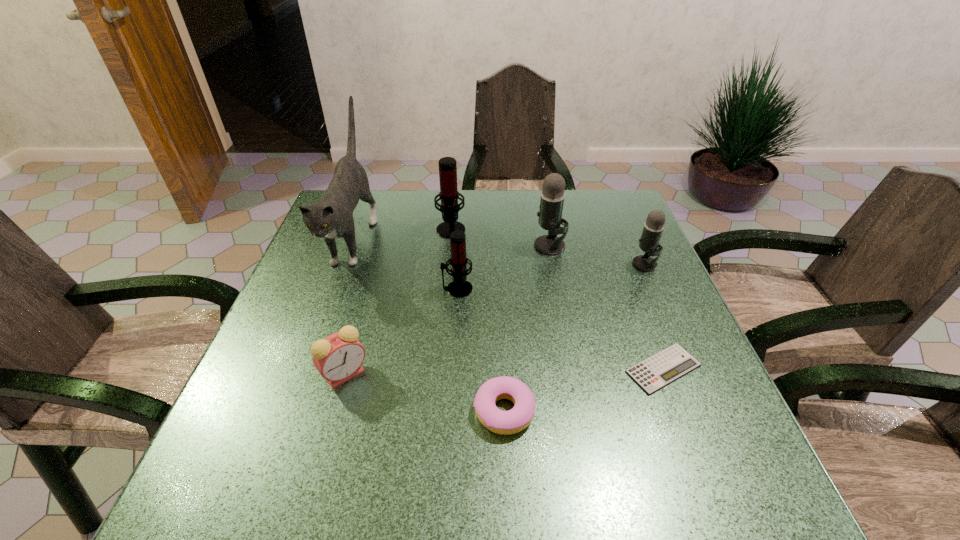
At what (x,y) coordinates should I click in order to perform the action: click on free space between the farther red microphone and the tallest object. Please return your answer as a coordinate pair (x, y). Image resolution: width=960 pixels, height=540 pixels. Looking at the image, I should click on (402, 233).

This screenshot has height=540, width=960. Find the location of `free spot between the fourth object from right to left and the cat`. free spot between the fourth object from right to left and the cat is located at coordinates (428, 324).

In order to click on vacant space that's between the nearer red microphone and the alarm clock in this screenshot , I will do `click(401, 332)`.

Locate which object ranks fifth in proximity to the bigger red microphone. Please provide its 2D coordinates. Your answer should be formatted as a tuple, i.e. [(x, y)], where the tuple contains the x and y coordinates of a point satisfying the conditions above.

[(652, 231)]

Locate which object is the closest to the bigger gray microphone. Please provide its 2D coordinates. Your answer should be formatted as a tuple, i.e. [(x, y)], where the tuple contains the x and y coordinates of a point satisfying the conditions above.

[(652, 231)]

Where is `the fourth closest microphone relative to the alarm clock`? Image resolution: width=960 pixels, height=540 pixels. the fourth closest microphone relative to the alarm clock is located at coordinates (652, 231).

Select which microphone is the second closest to the calculator. Please provide its 2D coordinates. Your answer should be formatted as a tuple, i.e. [(x, y)], where the tuple contains the x and y coordinates of a point satisfying the conditions above.

[(552, 196)]

The width and height of the screenshot is (960, 540). In order to click on vacant space that satisfies the following two spatial constraints: 1. at the face of the fifth object from left to right; 2. on the left side of the tallest object in this screenshot , I will do `click(290, 410)`.

Find the location of a particular element. vacant space that satisfies the following two spatial constraints: 1. at the face of the doughnut; 2. on the right side of the tallest object is located at coordinates (290, 410).

This screenshot has width=960, height=540. Find the location of `vacant space that satisfies the following two spatial constraints: 1. on the front side of the nearest microphone; 2. on the left side of the calculator`. vacant space that satisfies the following two spatial constraints: 1. on the front side of the nearest microphone; 2. on the left side of the calculator is located at coordinates (452, 368).